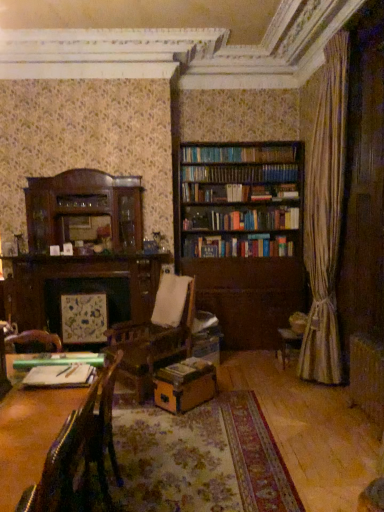
Find the location of a particular element. This screenshot has height=512, width=384. spots to the right of leather-like dark brown chair at lower left, the first chair positioned from the back is located at coordinates (168, 487).